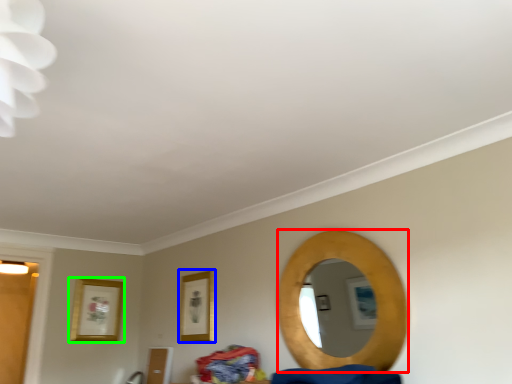
Question: Which is farther away from mirror (highlighted by a red box)? picture frame (highlighted by a blue box) or picture frame (highlighted by a green box)?

Choices:
 (A) picture frame
 (B) picture frame

Answer: (B)